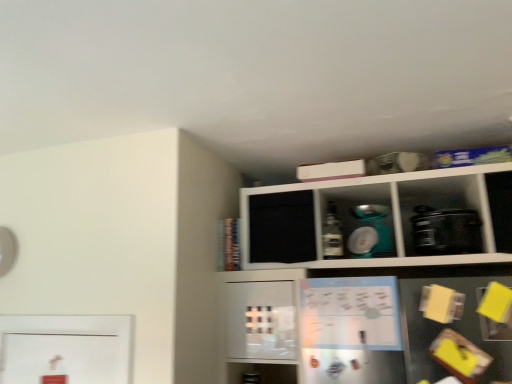
Question: From a real-world perspective, is black plastic toaster at right, which is the 2th appliance from left to right, physically located above or below matte plastic bottle at center?

Choices:
 (A) above
 (B) below

Answer: (B)

Question: Is black plastic toaster at right, placed as the 1th appliance when sorted from right to left, to the left or to the right of matte plastic bottle at center in the image?

Choices:
 (A) right
 (B) left

Answer: (A)

Question: Estimate the real-world distances between objects in this image. Which object is closer to the white matte cabinet at upper center?

Choices:
 (A) matte plastic bottle at center
 (B) matte white bowl at upper center, acting as the 2th appliance starting from the right
 (C) black plastic toaster at right, placed as the 1th appliance when sorted from right to left

Answer: (B)

Question: Which of these objects is positioned closest to the matte plastic bottle at center?

Choices:
 (A) black plastic toaster at right, placed as the 1th appliance when sorted from right to left
 (B) matte white bowl at upper center, acting as the 2th appliance starting from the right
 (C) white matte cabinet at upper center

Answer: (B)